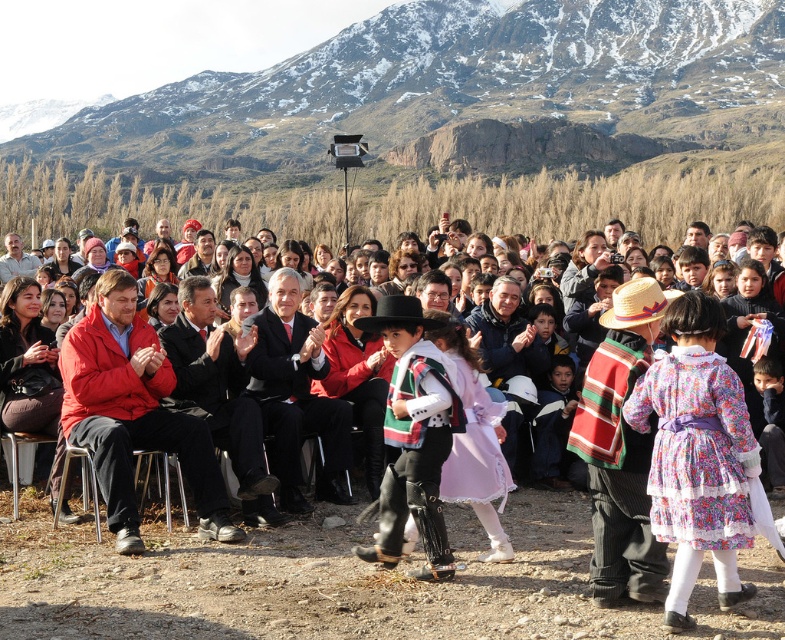
Is point (736, 124) closer to camera compared to point (650, 627)?

No.

You are a GUI agent. You are given a task and a screenshot of the screen. Output one action in this format:
    pyautogui.click(x=<x>, y=<y>)
    Task: Click on the snowy rock at upper center
    
    Given the screenshot: What is the action you would take?
    pyautogui.click(x=459, y=83)

Measure the distance between point (194, 163) and camera.

Point (194, 163) and camera are 184.76 meters apart from each other.

The height and width of the screenshot is (640, 785). In order to click on snowy rock at upper center in this screenshot , I will do `click(459, 83)`.

Looking at this image, does floral fabric dress at center have a greater height compared to pale pink satin dress at center?

Correct, floral fabric dress at center is much taller as pale pink satin dress at center.

Is point (743, 460) positioned before point (451, 490)?

Yes.

Is point (661, 538) positioned after point (468, 392)?

No, it is in front of (468, 392).

Identify the location of floral fabric dress at center. (696, 449).

Which of these two, knitted wool sweater at center or pale pink satin dress at center, stands shorter?

With less height is pale pink satin dress at center.

Can you confirm if knitted wool sweater at center is wider than pale pink satin dress at center?

Indeed, knitted wool sweater at center has a greater width compared to pale pink satin dress at center.

Find the location of a particular element. Image resolution: width=785 pixels, height=640 pixels. knitted wool sweater at center is located at coordinates (413, 436).